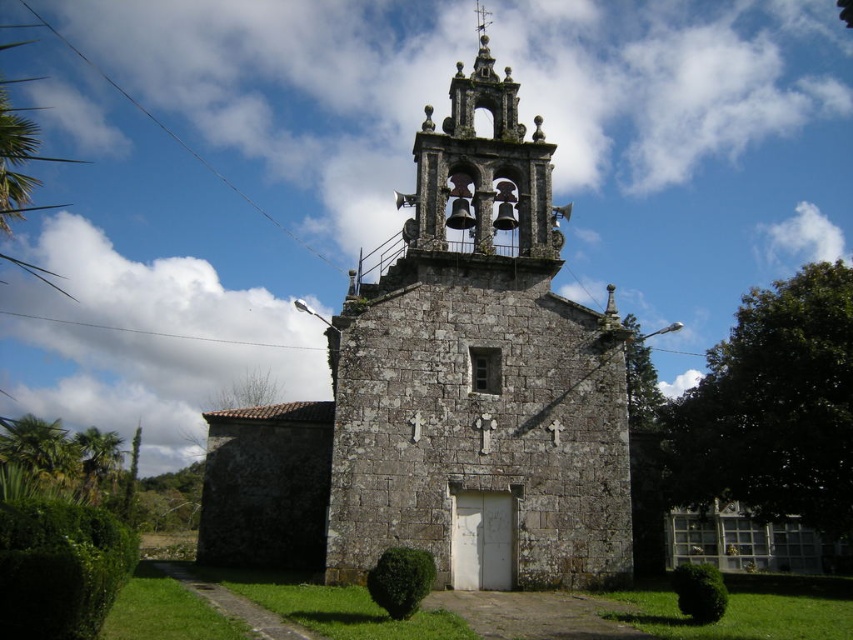
Which is behind, point (610, 428) or point (514, 112)?

The point (514, 112) is more distant.

Is point (527, 572) farther from viewer compared to point (525, 129)?

No, (527, 572) is closer to viewer.

Find the location of a particular element. This screenshot has height=640, width=853. gray stone chapel at center is located at coordinates (479, 376).